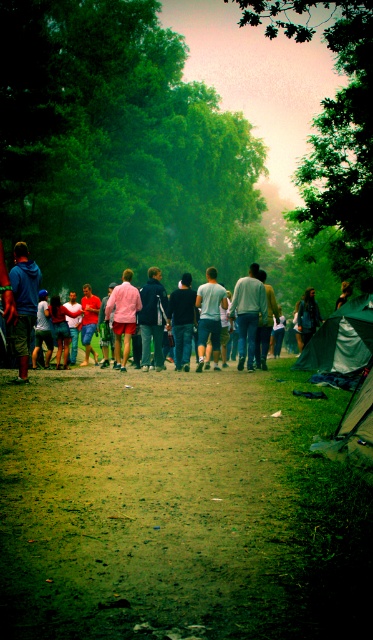
Question: Is brown dirt field at center to the right of green fabric tent at center from the viewer's perspective?

Choices:
 (A) no
 (B) yes

Answer: (A)

Question: Which point is closer to the camera?

Choices:
 (A) (151, 317)
 (B) (299, 323)
 (C) (180, 493)

Answer: (C)

Question: Among these points, which one is nearest to the camera?

Choices:
 (A) (255, 324)
 (B) (205, 324)
 (C) (10, 330)

Answer: (C)

Question: From the image, what is the correct spatial relationship of white cotton shirt at center in relation to dark blue jeans at center?

Choices:
 (A) below
 (B) above

Answer: (A)

Question: Is denim shorts at center below white cotton shirt at center?

Choices:
 (A) yes
 (B) no

Answer: (A)

Question: Which point is farther to the camera?

Choices:
 (A) brown dirt field at center
 (B) light blue jeans at center

Answer: (B)